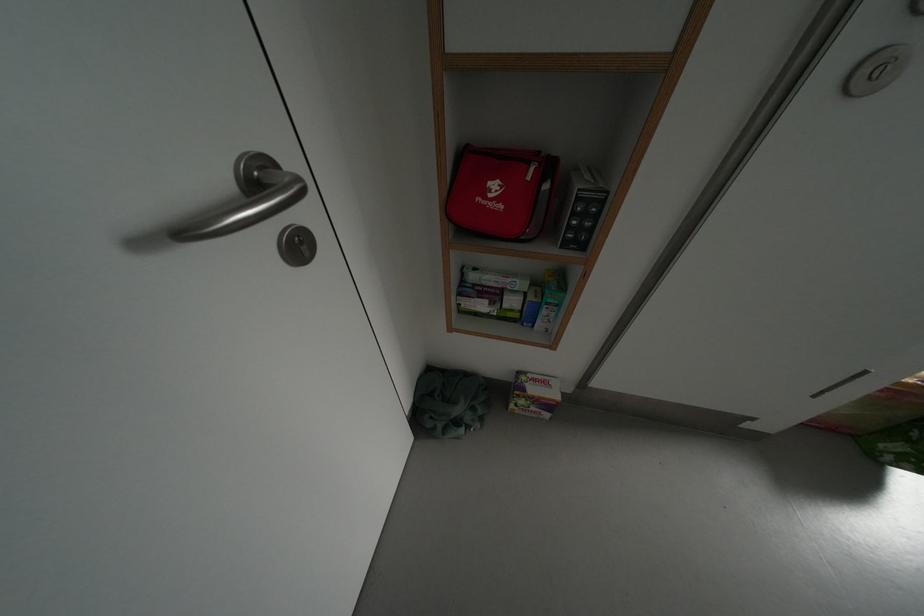
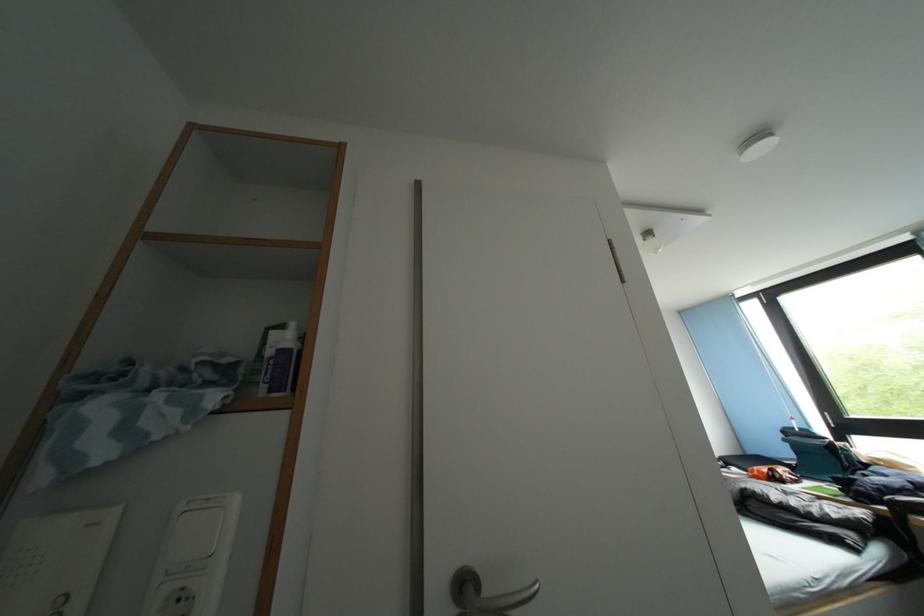
Based on the continuous images, in which direction is the camera rotating?

The camera's rotation is toward right-up.